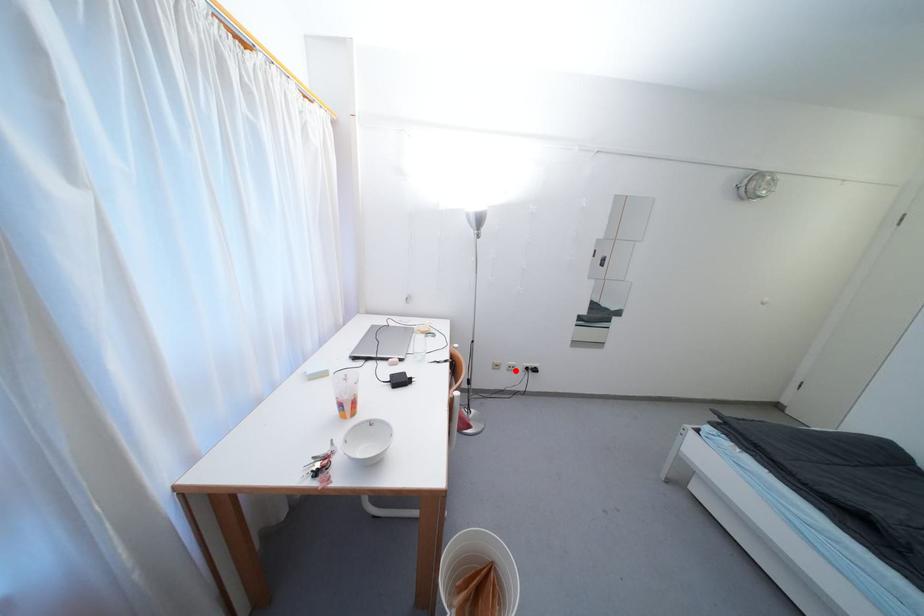
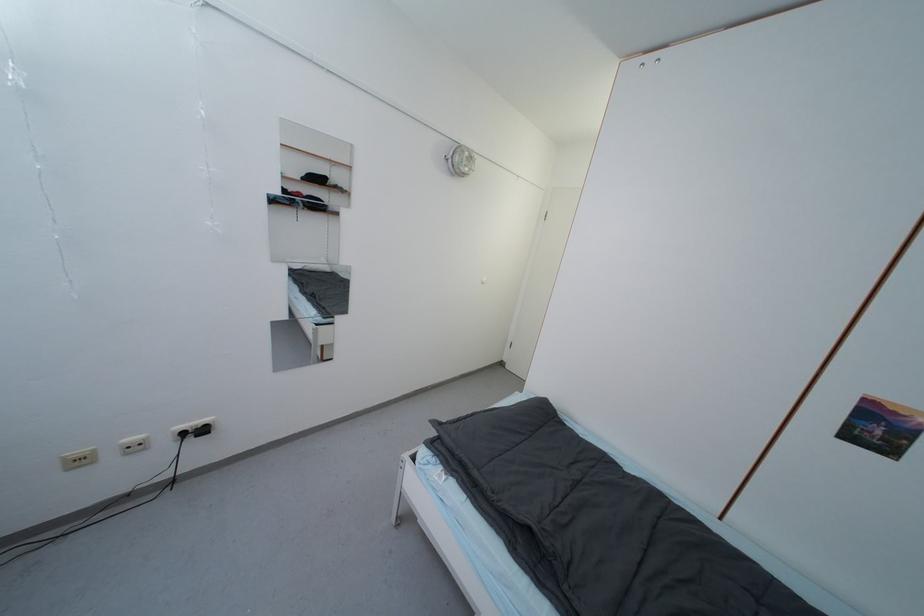
Question: I am providing you with two images of the same scene from different viewpoints. Image1 has a red point marked. In image2, the corresponding 3D location appears at what relative position? Reply with the corresponding letter.

Choices:
 (A) Closer
 (B) Farther

Answer: (A)